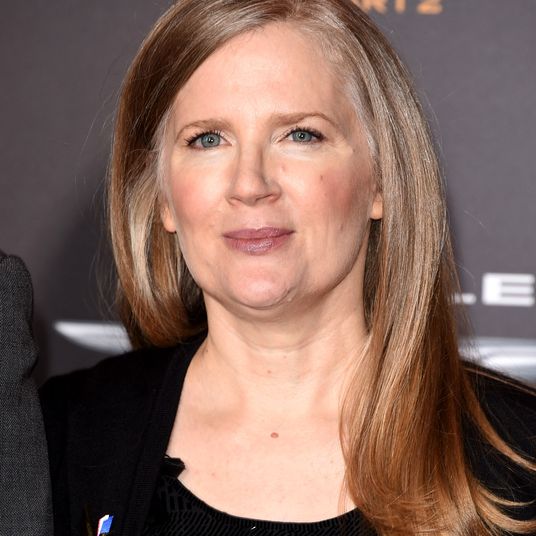
Image resolution: width=536 pixels, height=536 pixels. What are the coordinates of `gray wall in the background` in the screenshot? It's located at (478, 128).